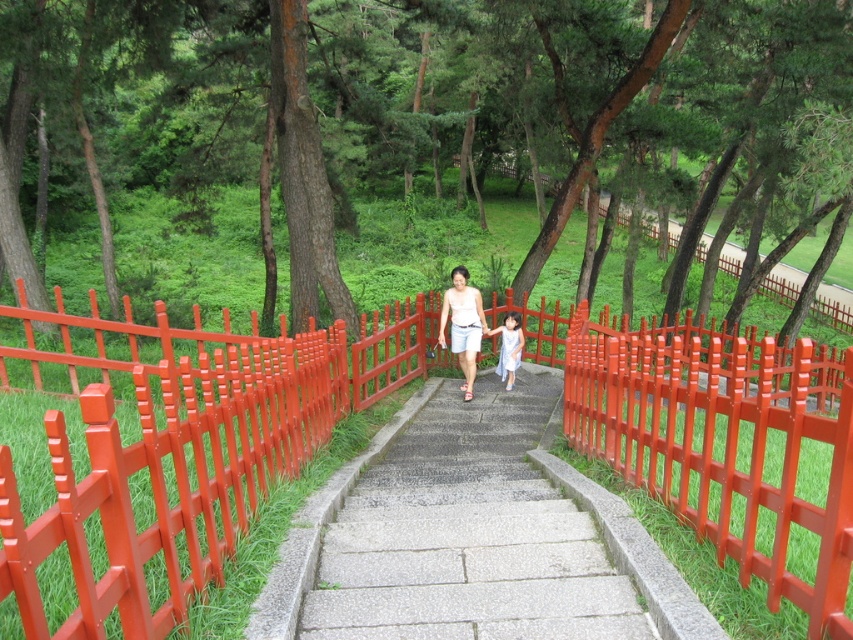
Question: Is red plastic fence at center bigger than gray concrete stairs at center?

Choices:
 (A) no
 (B) yes

Answer: (B)

Question: Which is farther from the gray concrete stairs at center?

Choices:
 (A) red plastic fence at center
 (B) light purple fabric dress at center

Answer: (A)

Question: Which object is closer to the camera taking this photo?

Choices:
 (A) matte white blouse at center
 (B) gray concrete stairs at center
 (C) red plastic fence at center

Answer: (C)

Question: Can you confirm if gray concrete stairs at center is thinner than matte white blouse at center?

Choices:
 (A) yes
 (B) no

Answer: (B)

Question: Is red plastic fence at center to the right of light purple fabric dress at center from the viewer's perspective?

Choices:
 (A) yes
 (B) no

Answer: (A)

Question: Which is nearer to the gray concrete stairs at center?

Choices:
 (A) red plastic fence at center
 (B) matte white blouse at center

Answer: (A)